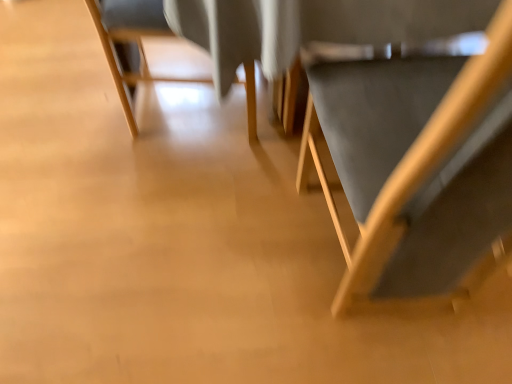
Describe the element at coordinates (131, 40) in the screenshot. The image size is (512, 384). I see `matte gray chair at center` at that location.

Find the location of a particular element. This screenshot has height=384, width=512. matte gray chair at center is located at coordinates (131, 40).

The height and width of the screenshot is (384, 512). Identify the location of matte gray chair at center. (131, 40).